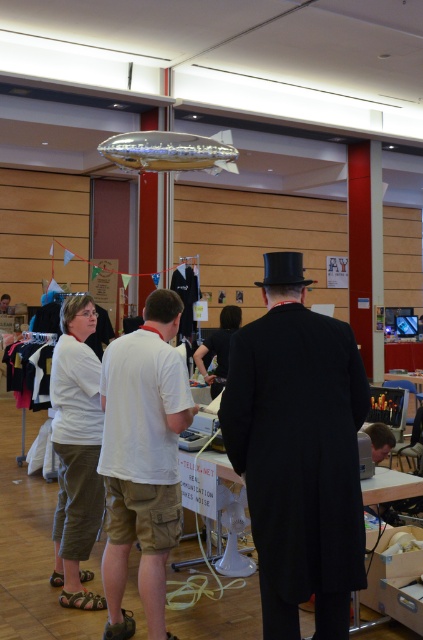
Is point (277, 468) positioned behind point (175, 524)?

That is False.

Can you confirm if black matte coat at center is wider than white cotton t-shirt at center?

Correct, the width of black matte coat at center exceeds that of white cotton t-shirt at center.

The width and height of the screenshot is (423, 640). What are the coordinates of `black matte coat at center` in the screenshot? It's located at (299, 452).